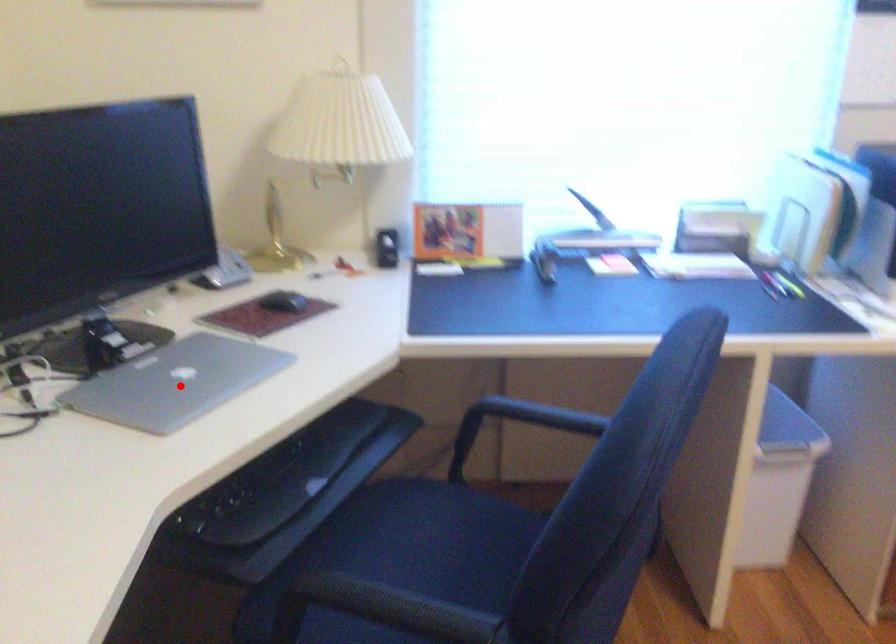
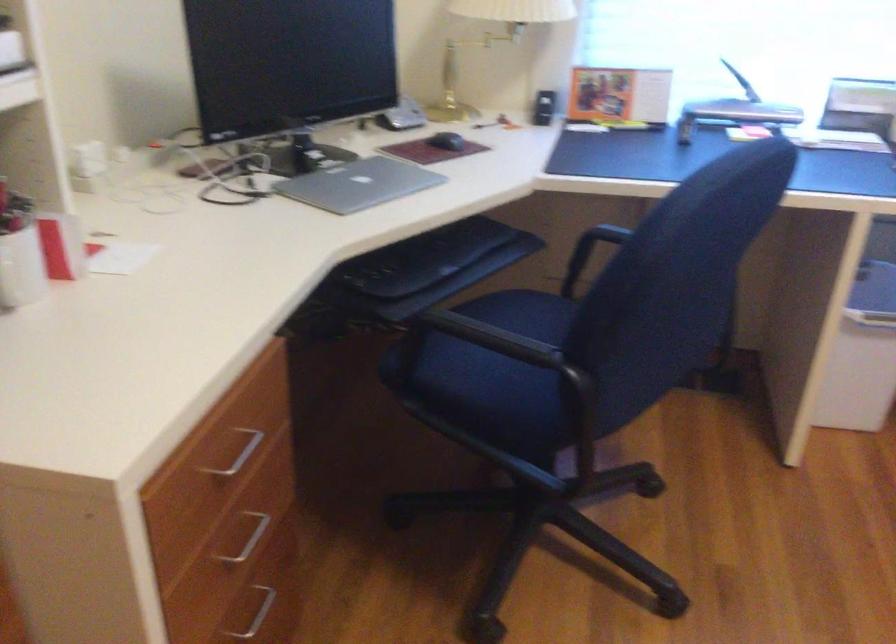
In the second image, find the point that corresponds to the highlighted location in the first image.

(358, 184)